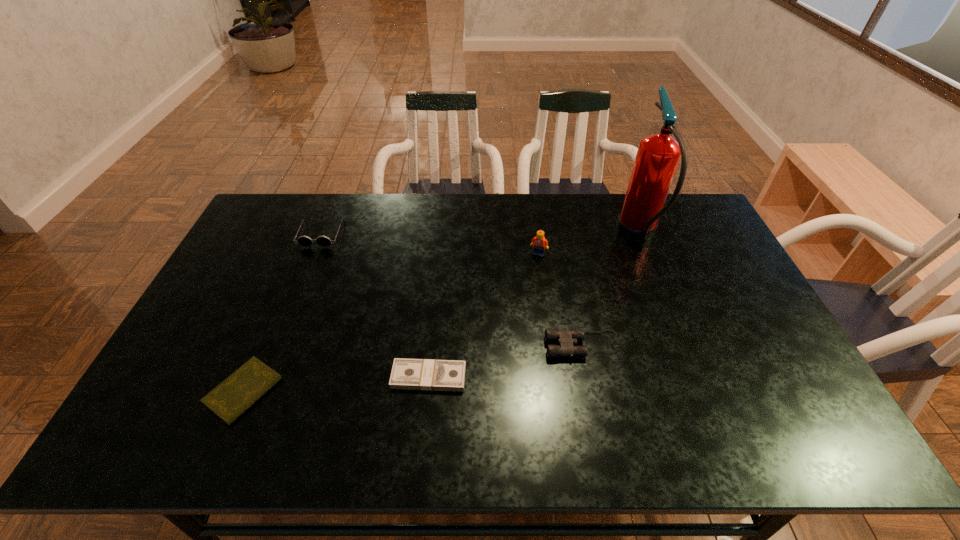
Find the location of a particular element. This screenshot has width=960, height=540. the rightmost object is located at coordinates (658, 155).

Image resolution: width=960 pixels, height=540 pixels. In order to click on the tallest object in this screenshot , I will do `click(658, 155)`.

This screenshot has width=960, height=540. I want to click on Lego, so pyautogui.click(x=539, y=242).

Locate an element on the screen. The height and width of the screenshot is (540, 960). the third tallest object is located at coordinates (305, 241).

Where is `binoculars`? binoculars is located at coordinates (566, 339).

What are the coordinates of `dollar` in the screenshot? It's located at (409, 374).

At what (x,y) coordinates should I click in order to perform the action: click on diary. Please return your answer as a coordinate pair (x, y). The image size is (960, 540). Looking at the image, I should click on (232, 397).

In order to click on free spot located on the front of the rightmost object in this screenshot , I will do `click(685, 357)`.

Where is `free space located 0.050m on the front-facing side of the Lego`? This screenshot has width=960, height=540. free space located 0.050m on the front-facing side of the Lego is located at coordinates (540, 268).

Identify the location of vacant region located 0.090m on the front-facing side of the sunglasses. (309, 266).